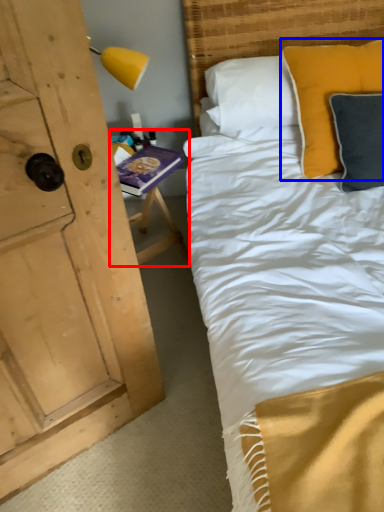
Question: Among these objects, which one is nearest to the camera, table (highlighted by a red box) or pillow (highlighted by a blue box)?

Choices:
 (A) table
 (B) pillow

Answer: (B)